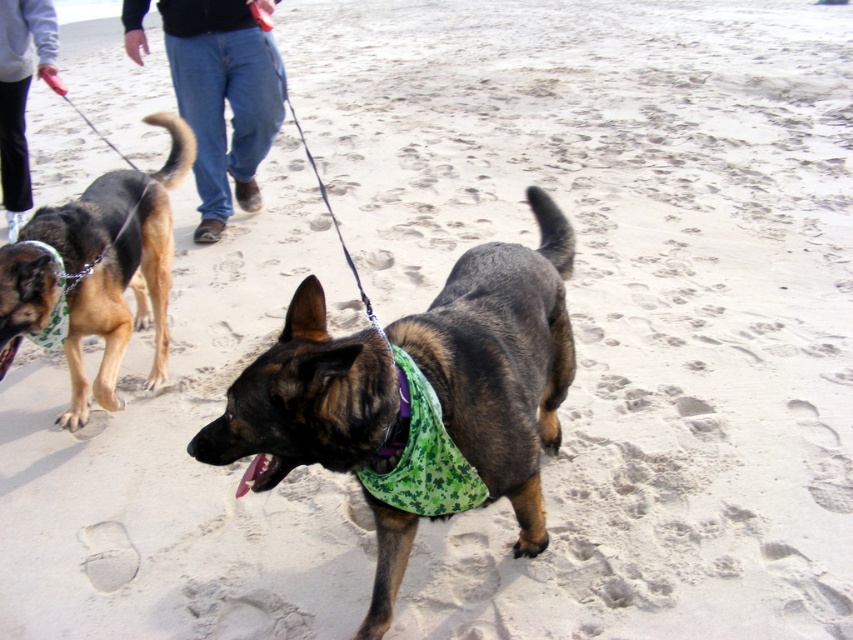
Question: Does brown fur dog at center appear under light gray fleece jacket at upper left?

Choices:
 (A) no
 (B) yes

Answer: (B)

Question: Which point appears closest to the camera in this image?

Choices:
 (A) (294, 298)
 (B) (199, 68)
 (C) (440, 509)
 (D) (15, 38)

Answer: (A)

Question: Which point is farther from the camera taking this photo?

Choices:
 (A) (277, 74)
 (B) (264, 422)

Answer: (A)

Question: Can you confirm if brown fur dog at center is wider than light gray fleece jacket at upper left?

Choices:
 (A) no
 (B) yes

Answer: (A)

Question: Is brown fur dog at left thinner than brown fur dog at center?

Choices:
 (A) yes
 (B) no

Answer: (A)

Question: Which object is closer to the camera taking this photo?

Choices:
 (A) light gray fleece jacket at upper left
 (B) brown fur dog at left

Answer: (B)